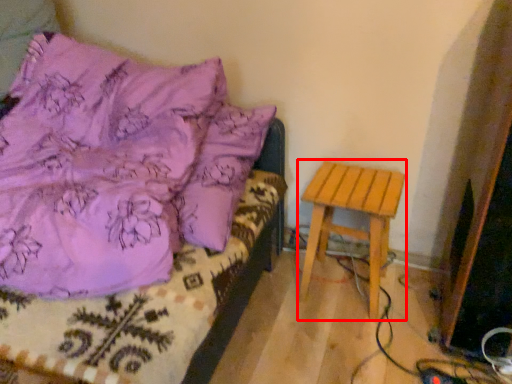
Question: From the image, what is the correct spatial relationship of stool (annotated by the red box) in relation to furniture?

Choices:
 (A) left
 (B) right

Answer: (B)